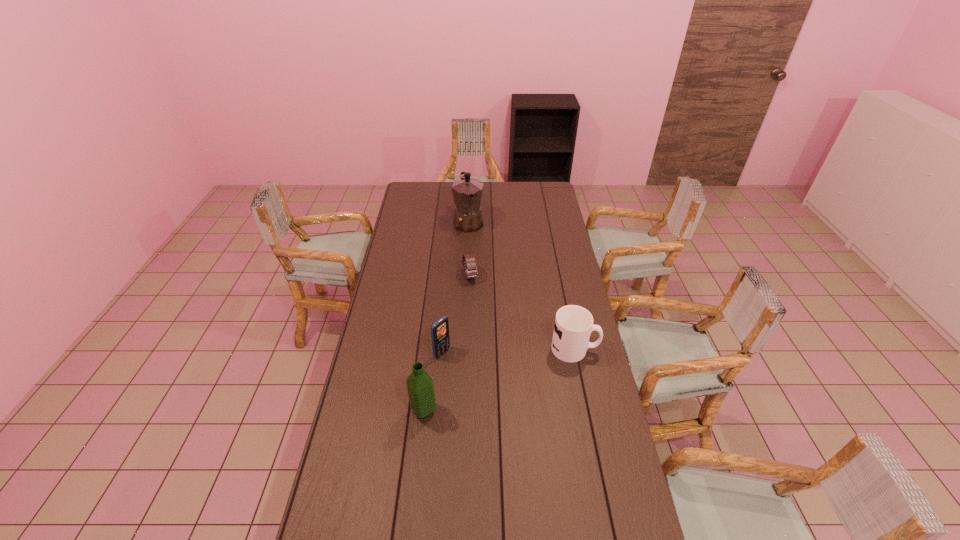
Where is `empty location between the cellular telephone and the mug`? empty location between the cellular telephone and the mug is located at coordinates (509, 351).

I want to click on unoccupied position between the fourth nearest object and the coffeepot, so coord(469,249).

Image resolution: width=960 pixels, height=540 pixels. I want to click on the second closest object relative to the second farthest object, so click(440, 329).

Locate which object ranks second in proximity to the fourth nearest object. Please provide its 2D coordinates. Your answer should be formatted as a tuple, i.e. [(x, y)], where the tuple contains the x and y coordinates of a point satisfying the conditions above.

[(440, 329)]

The height and width of the screenshot is (540, 960). I want to click on vacant point that satisfies the following two spatial constraints: 1. on the back side of the watch; 2. on the left side of the second tallest object, so click(439, 276).

Identify the location of free location that satisfies the following two spatial constraints: 1. on the back side of the cellular telephone; 2. on the handle side of the mug. The height and width of the screenshot is (540, 960). (443, 349).

Identify the location of free region that satisfies the following two spatial constraints: 1. on the front side of the mug; 2. on the handle side of the watch. This screenshot has height=540, width=960. (468, 349).

The height and width of the screenshot is (540, 960). In order to click on vacant space that satisfies the following two spatial constraints: 1. on the front side of the coffeepot; 2. on the handle side of the mug in this screenshot , I will do `click(464, 349)`.